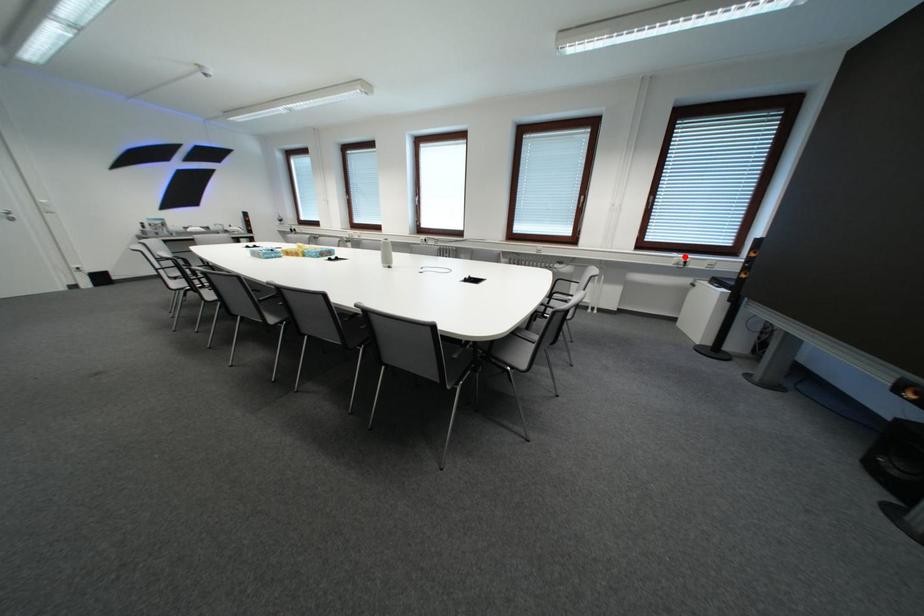
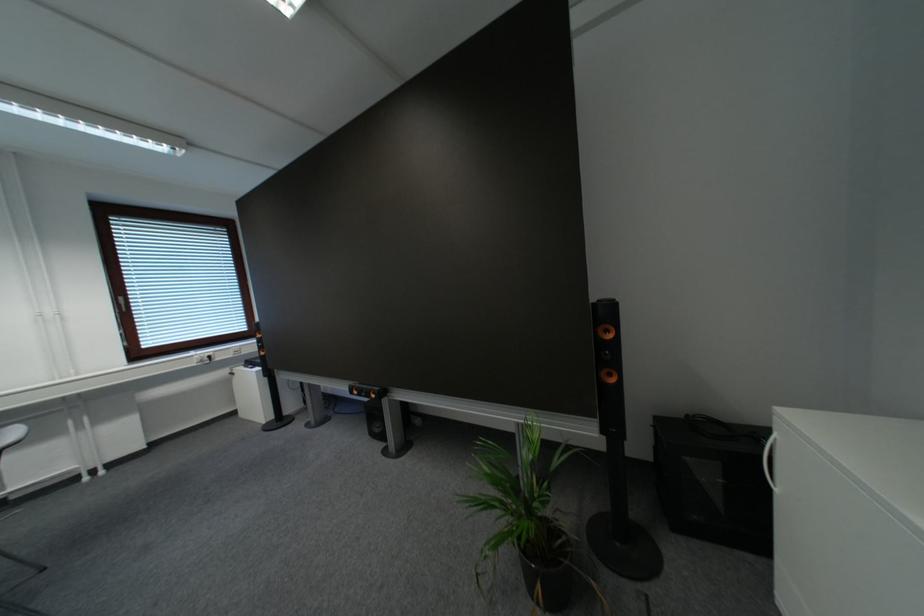
The point at the highlighted location is marked in the first image. Where is the corresponding point in the second image?

(201, 355)